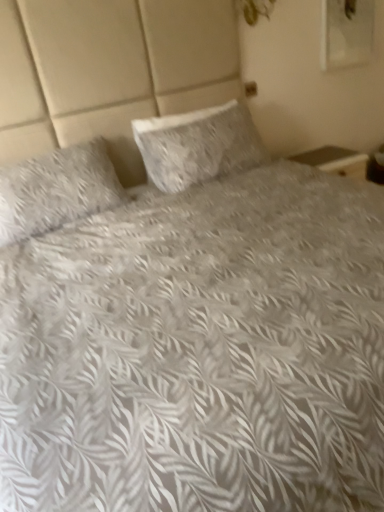
Question: From the image's perspective, is white textured pillow at center, which appears as the first pillow when viewed from the right, located above or below fluffy white pillow at left, which ranks as the 1th pillow in left-to-right order?

Choices:
 (A) below
 (B) above

Answer: (B)

Question: Is white textured pillow at center, the 2th pillow when ordered from left to right, inside the boundaries of fluffy white pillow at left, placed as the second pillow when sorted from right to left, or outside?

Choices:
 (A) inside
 (B) outside

Answer: (B)

Question: Considering their positions, is white textured pillow at center, which appears as the first pillow when viewed from the right, located in front of or behind fluffy white pillow at left, placed as the second pillow when sorted from right to left?

Choices:
 (A) behind
 (B) front

Answer: (A)

Question: Would you say fluffy white pillow at left, which ranks as the 1th pillow in left-to-right order, is to the left or to the right of white textured pillow at center, the 2th pillow when ordered from left to right, in the picture?

Choices:
 (A) left
 (B) right

Answer: (A)

Question: From the image's perspective, relative to white textured pillow at center, which appears as the first pillow when viewed from the right, is fluffy white pillow at left, which ranks as the 1th pillow in left-to-right order, above or below?

Choices:
 (A) above
 (B) below

Answer: (B)

Question: Is point (36, 192) closer or farther from the camera than point (213, 130)?

Choices:
 (A) farther
 (B) closer

Answer: (B)

Question: Is fluffy white pillow at left, placed as the second pillow when sorted from right to left, wider or thinner than white textured pillow at center, the 2th pillow when ordered from left to right?

Choices:
 (A) thin
 (B) wide

Answer: (B)